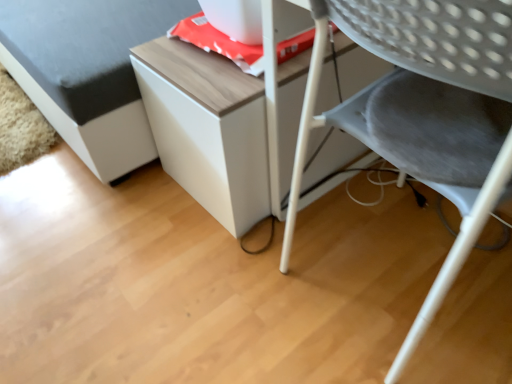
Question: From the image's perspective, would you say gray fabric chair at lower right is shown under wooden table at center?

Choices:
 (A) no
 (B) yes

Answer: (B)

Question: Considering the relative sizes of gray fabric chair at lower right and wooden table at center in the image provided, is gray fabric chair at lower right thinner than wooden table at center?

Choices:
 (A) yes
 (B) no

Answer: (A)

Question: Is gray fabric chair at lower right looking in the opposite direction of wooden table at center?

Choices:
 (A) yes
 (B) no

Answer: (B)

Question: Is gray fabric chair at lower right positioned in front of wooden table at center?

Choices:
 (A) yes
 (B) no

Answer: (A)

Question: Is gray fabric chair at lower right located outside wooden table at center?

Choices:
 (A) yes
 (B) no

Answer: (A)

Question: Is gray fabric chair at lower right in front of or behind white matte cabinet at upper center in the image?

Choices:
 (A) front
 (B) behind

Answer: (A)

Question: Is gray fabric chair at lower right wider or thinner than white matte cabinet at upper center?

Choices:
 (A) wide
 (B) thin

Answer: (B)

Question: Considering the positions of gray fabric chair at lower right and white matte cabinet at upper center in the image, is gray fabric chair at lower right taller or shorter than white matte cabinet at upper center?

Choices:
 (A) tall
 (B) short

Answer: (A)

Question: In terms of size, does gray fabric chair at lower right appear bigger or smaller than white matte cabinet at upper center?

Choices:
 (A) small
 (B) big

Answer: (A)

Question: From a real-world perspective, is gray fabric chair at lower right above or below wooden table at center?

Choices:
 (A) above
 (B) below

Answer: (A)

Question: In terms of width, does gray fabric chair at lower right look wider or thinner when compared to wooden table at center?

Choices:
 (A) thin
 (B) wide

Answer: (A)

Question: Is point (501, 44) closer or farther from the camera than point (207, 125)?

Choices:
 (A) farther
 (B) closer

Answer: (B)

Question: Is gray fabric chair at lower right spatially inside wooden table at center, or outside of it?

Choices:
 (A) inside
 (B) outside

Answer: (B)

Question: In the image, is white matte cabinet at upper center positioned in front of or behind wooden table at center?

Choices:
 (A) behind
 (B) front

Answer: (B)

Question: From the image's perspective, is white matte cabinet at upper center located above or below wooden table at center?

Choices:
 (A) above
 (B) below

Answer: (A)